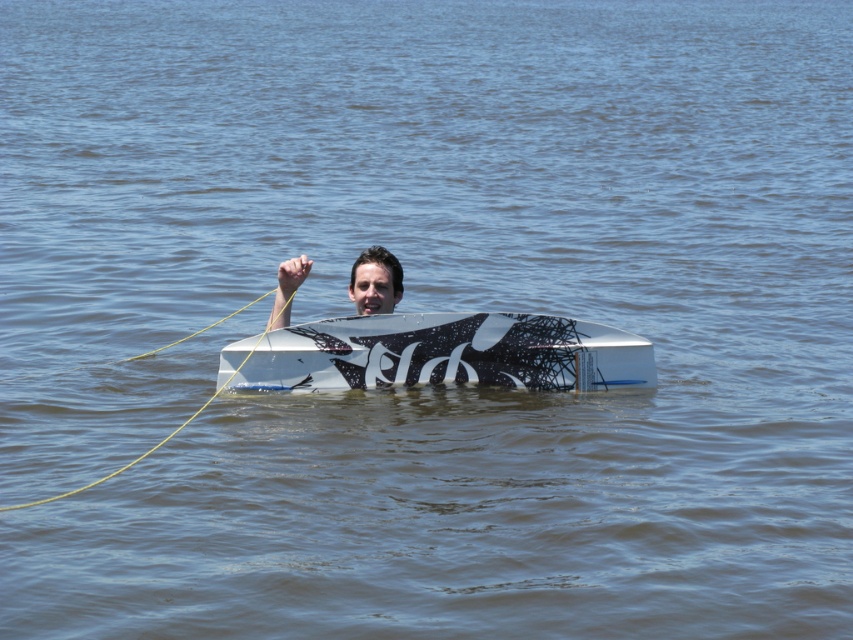
Question: Which of the following is the closest to the observer?

Choices:
 (A) matte black surfboard at center
 (B) white matte surfboard at center

Answer: (B)

Question: Does white matte surfboard at center have a lesser width compared to matte black surfboard at center?

Choices:
 (A) yes
 (B) no

Answer: (B)

Question: Which object is farther from the camera taking this photo?

Choices:
 (A) matte black surfboard at center
 (B) white matte surfboard at center

Answer: (A)

Question: Among these points, which one is nearest to the camera?

Choices:
 (A) (567, 330)
 (B) (390, 305)

Answer: (A)

Question: Can you confirm if white matte surfboard at center is positioned to the right of matte black surfboard at center?

Choices:
 (A) yes
 (B) no

Answer: (A)

Question: Is white matte surfboard at center smaller than matte black surfboard at center?

Choices:
 (A) yes
 (B) no

Answer: (B)